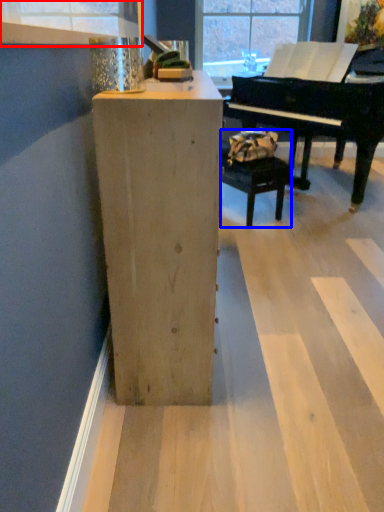
Question: Which point is further to the camera, window frame (highlighted by a red box) or armchair (highlighted by a blue box)?

Choices:
 (A) window frame
 (B) armchair

Answer: (B)